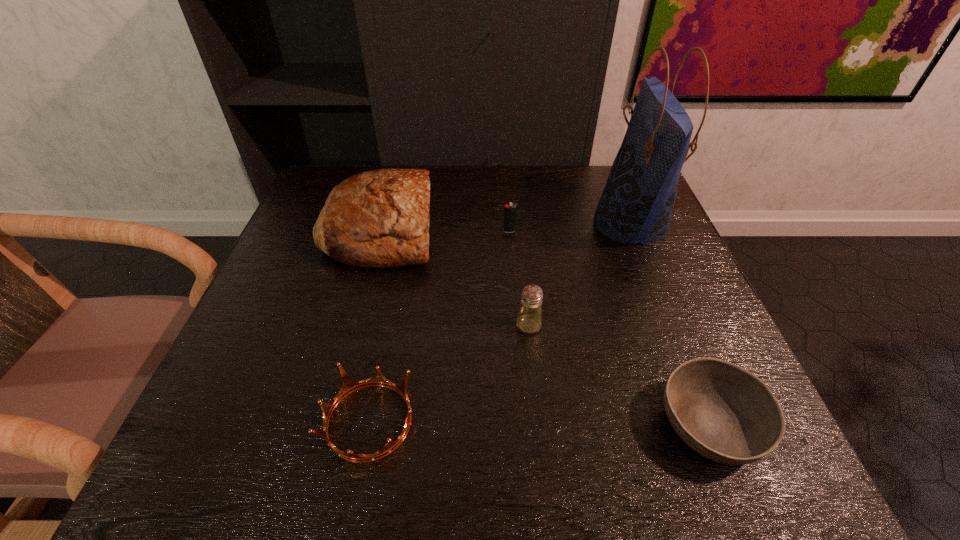
At what (x,y) coordinates should I click in order to perform the action: click on the tallest object. Please return your answer as a coordinate pair (x, y). Image resolution: width=960 pixels, height=540 pixels. Looking at the image, I should click on (637, 202).

At what (x,y) coordinates should I click in order to perform the action: click on the second tallest object. Please return your answer as a coordinate pair (x, y). The height and width of the screenshot is (540, 960). Looking at the image, I should click on (380, 218).

You are a GUI agent. You are given a task and a screenshot of the screen. Output one action in this format:
    pyautogui.click(x=<x>, y=<y>)
    Task: Click on the saltshaker
    The width and height of the screenshot is (960, 540).
    Given the screenshot: What is the action you would take?
    pyautogui.click(x=529, y=320)

The image size is (960, 540). I want to click on the fourth shortest object, so click(x=529, y=320).

What are the coordinates of `igniter` in the screenshot? It's located at (510, 211).

The height and width of the screenshot is (540, 960). I want to click on crown, so click(348, 385).

Locate an element on the screen. The image size is (960, 540). bowl is located at coordinates (723, 412).

The image size is (960, 540). Find the location of `free point located 0.300m on the front of the shopping bag`. free point located 0.300m on the front of the shopping bag is located at coordinates (690, 373).

Locate an element on the screen. The image size is (960, 540). vacant space located 0.180m at the sliced front of the fifth shortest object is located at coordinates point(508,230).

You are a GUI agent. You are given a task and a screenshot of the screen. Output one action in this format:
    pyautogui.click(x=<x>, y=<y>)
    Task: Click on the free region located on the back of the fourth farthest object
    
    Given the screenshot: What is the action you would take?
    pyautogui.click(x=520, y=241)